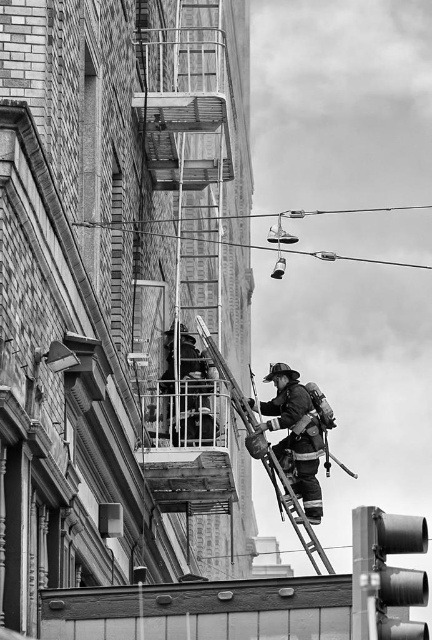
Question: Can you confirm if reflective silver helmet at center is positioned above metallic gray traffic light at lower right?

Choices:
 (A) no
 (B) yes

Answer: (B)

Question: Which of the following is the farthest from the observer?

Choices:
 (A) metallic gray traffic light at lower right
 (B) reflective silver helmet at center
 (C) metallic wire at upper center
 (D) metallic silver ladder at center

Answer: (B)

Question: Based on their relative distances, which object is farther from the metallic silver ladder at center?

Choices:
 (A) metallic gray traffic light at lower right
 (B) rustic metal fire escape at center
 (C) metallic wire at upper center
 (D) reflective silver helmet at center

Answer: (C)

Question: Which of the following is the farthest from the observer?

Choices:
 (A) (380, 627)
 (B) (174, 440)
 (C) (352, 259)

Answer: (C)

Question: Does reflective silver helmet at center appear under metallic silver ladder at center?

Choices:
 (A) yes
 (B) no

Answer: (B)

Question: Does reflective silver helmet at center have a smaller size compared to metallic silver ladder at center?

Choices:
 (A) yes
 (B) no

Answer: (A)